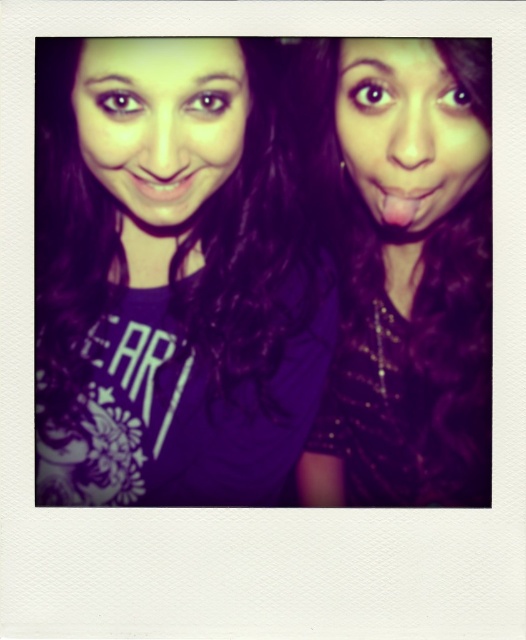
Question: Which of the following is the farthest from the observer?

Choices:
 (A) (393, 216)
 (B) (392, 323)
 (C) (210, 74)

Answer: (B)

Question: Does purple matte shirt at center appear over matte pink lips at center?

Choices:
 (A) no
 (B) yes

Answer: (A)

Question: Which object is the closest to the pink glossy tongue at center?

Choices:
 (A) purple matte shirt at center
 (B) matte pink lips at center
 (C) matte skin at upper right
 (D) matte skin at upper left

Answer: (C)

Question: Is matte skin at upper left thinner than pink glossy tongue at center?

Choices:
 (A) no
 (B) yes

Answer: (A)

Question: Which of the following is the farthest from the observer?

Choices:
 (A) purple matte shirt at center
 (B) matte pink lips at center

Answer: (B)

Question: Is purple sequined dress at center positioned before matte skin at upper left?

Choices:
 (A) yes
 (B) no

Answer: (B)